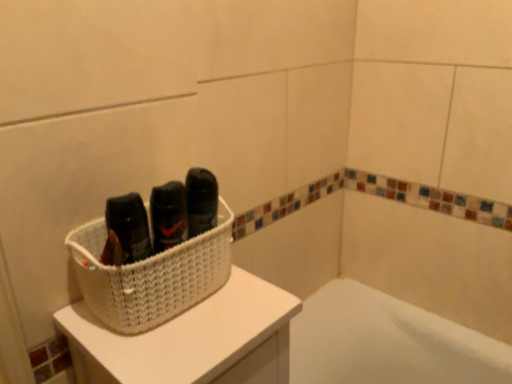
Question: Does white woven basket at upper left have a smaller size compared to white woven basket at upper left?

Choices:
 (A) yes
 (B) no

Answer: (B)

Question: Is white woven basket at upper left far away from white woven basket at upper left?

Choices:
 (A) yes
 (B) no

Answer: (B)

Question: Is white woven basket at upper left at the back of white woven basket at upper left?

Choices:
 (A) yes
 (B) no

Answer: (B)

Question: Considering the relative positions of white woven basket at upper left and white woven basket at upper left in the image provided, is white woven basket at upper left to the left of white woven basket at upper left from the viewer's perspective?

Choices:
 (A) yes
 (B) no

Answer: (B)

Question: From a real-world perspective, is white woven basket at upper left physically below white woven basket at upper left?

Choices:
 (A) yes
 (B) no

Answer: (A)

Question: From the image's perspective, is white woven basket at upper left on top of white woven basket at upper left?

Choices:
 (A) no
 (B) yes

Answer: (A)

Question: Is white woven basket at upper left touching white woven basket at upper left?

Choices:
 (A) yes
 (B) no

Answer: (A)

Question: Would you say white woven basket at upper left is a long distance from white woven basket at upper left?

Choices:
 (A) yes
 (B) no

Answer: (B)

Question: Is white woven basket at upper left smaller than white woven basket at upper left?

Choices:
 (A) no
 (B) yes

Answer: (B)

Question: Is the depth of white woven basket at upper left greater than that of white woven basket at upper left?

Choices:
 (A) yes
 (B) no

Answer: (A)

Question: Can you confirm if white woven basket at upper left is positioned to the right of white woven basket at upper left?

Choices:
 (A) yes
 (B) no

Answer: (B)

Question: From the image's perspective, is white woven basket at upper left located above white woven basket at upper left?

Choices:
 (A) no
 (B) yes

Answer: (B)

Question: Looking at their shapes, would you say white woven basket at upper left is wider or thinner than white woven basket at upper left?

Choices:
 (A) wide
 (B) thin

Answer: (B)